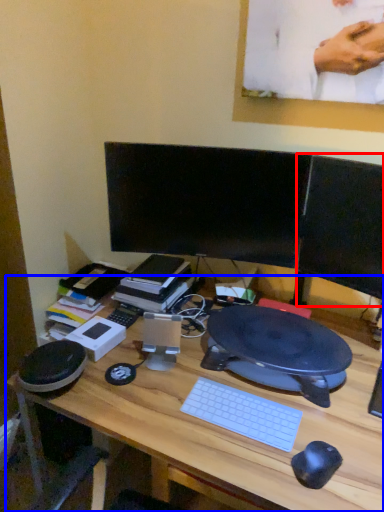
Question: Among these objects, which one is nearest to the camera, computer monitor (highlighted by a red box) or desk (highlighted by a blue box)?

Choices:
 (A) computer monitor
 (B) desk

Answer: (B)